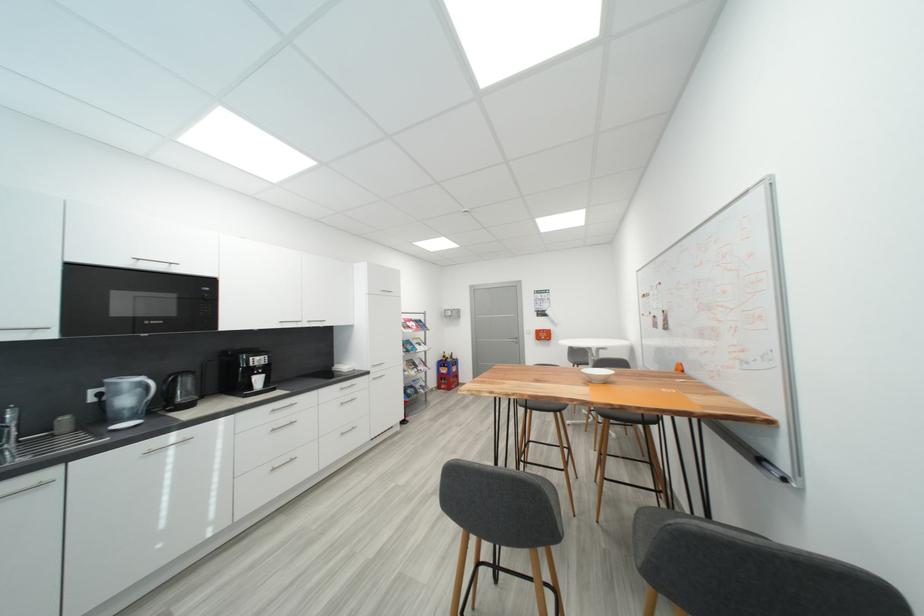
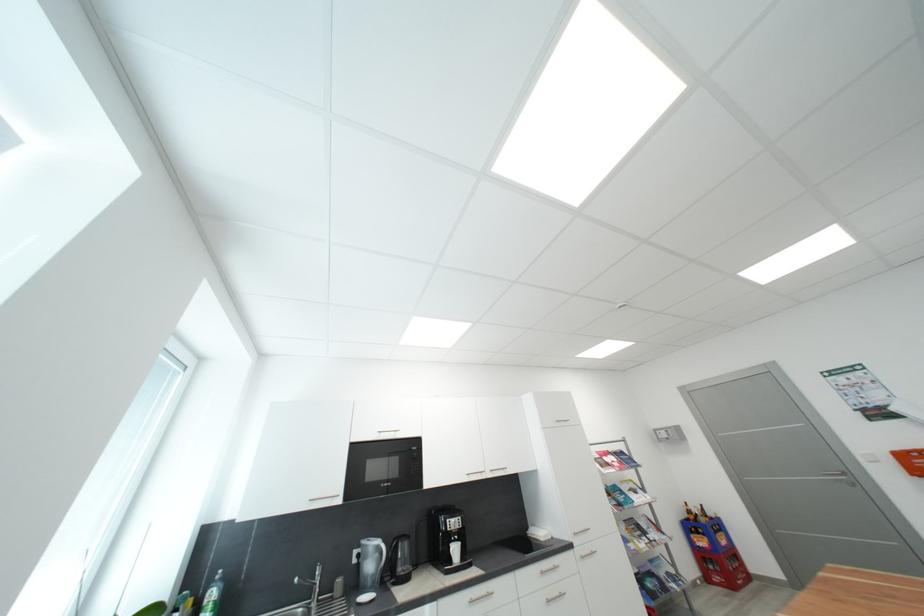
The point at (456, 362) is marked in the first image. Where is the corresponding point in the second image?

(710, 522)